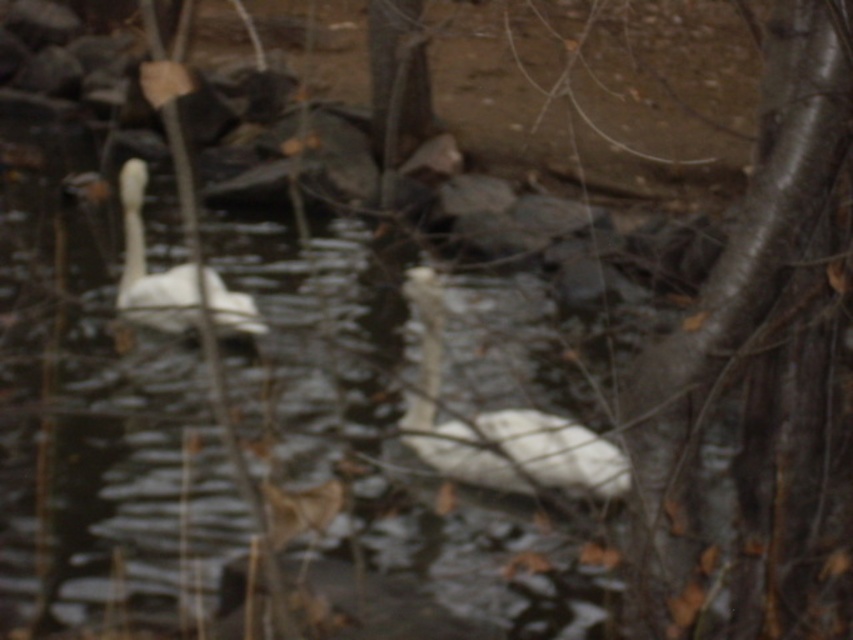
You are standing at the edge of the water and see the point at coordinates (497, 422). Based on the scene description, what object is located at that point?

The point at coordinates (497, 422) is located on the white matte swan at center.

You are a wildlife photographer aiming to capture a closeup shot of the two white matte swan at center and white matte swan at upper left. Your camera has a maximum focus range of 2 meters. Can you take a photo of both swans in focus at the same time?

The white matte swan at center is 1.96 meters away from the white matte swan at upper left. Since the distance between them is within the camera maximum focus range of 2 meters, you can take a photo of both swans in focus at the same time.

You are an ornithologist observing two white matte swans in a lake. You notice the white matte swan at center and the white matte swan at upper left. Which swan is closer to you based on their sizes?

The white matte swan at center is larger in size than the white matte swan at upper left, so it is closer to you because closer objects appear larger.